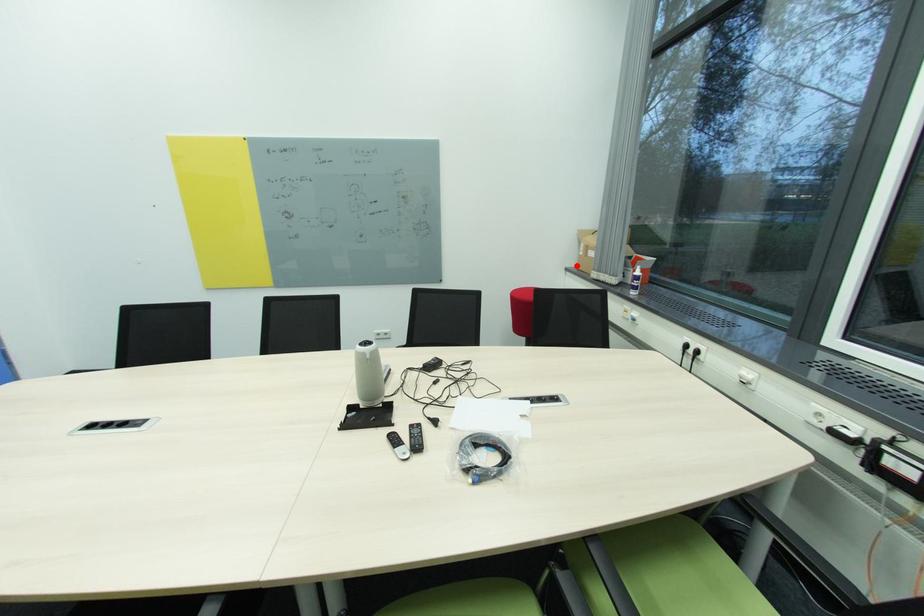
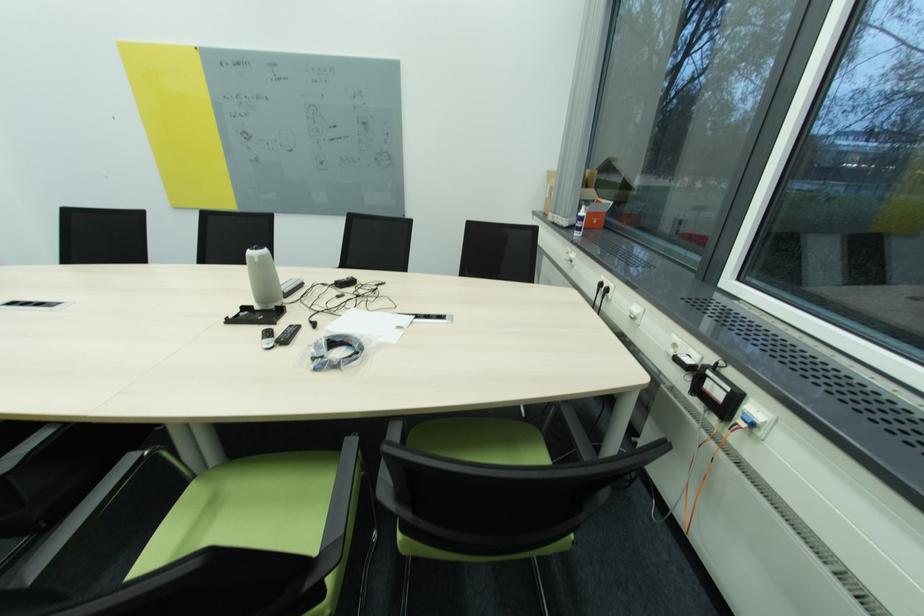
Question: A red point is marked in image1. In image2, is the corresponding 3D point closer to the camera or farther? Reply with the corresponding letter.

Choices:
 (A) The corresponding 3D point is closer.
 (B) The corresponding 3D point is farther.

Answer: (B)